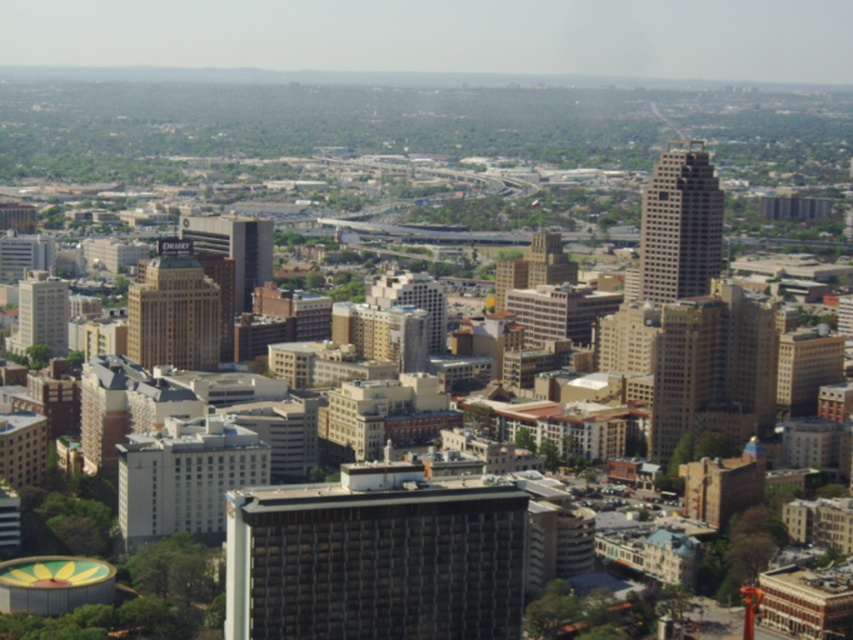
Is dark gray concrete building at center wider than brown brick building at center?

Correct, the width of dark gray concrete building at center exceeds that of brown brick building at center.

Is dark gray concrete building at center closer to the viewer compared to brown brick building at center?

Yes.

What do you see at coordinates (375, 557) in the screenshot?
I see `dark gray concrete building at center` at bounding box center [375, 557].

This screenshot has height=640, width=853. I want to click on dark gray concrete building at center, so click(375, 557).

Is gray concrete skyscraper at upper right smaller than beige concrete building at left?

Actually, gray concrete skyscraper at upper right might be larger than beige concrete building at left.

Can you confirm if gray concrete skyscraper at upper right is positioned to the left of beige concrete building at left?

Incorrect, gray concrete skyscraper at upper right is not on the left side of beige concrete building at left.

Who is more forward, (689, 212) or (33, 317)?

Positioned in front is point (689, 212).

Where is `gray concrete skyscraper at upper right`? This screenshot has height=640, width=853. gray concrete skyscraper at upper right is located at coordinates (679, 225).

Does matte glass skyscraper at center appear over beige concrete building at left?

Yes.

Can you confirm if matte glass skyscraper at center is bigger than beige concrete building at left?

Yes.

Does point (252, 275) lie in front of point (28, 317)?

Yes, point (252, 275) is closer to viewer.

At what (x,y) coordinates should I click in order to perform the action: click on matte glass skyscraper at center. Please return your answer as a coordinate pair (x, y). The height and width of the screenshot is (640, 853). Looking at the image, I should click on (234, 248).